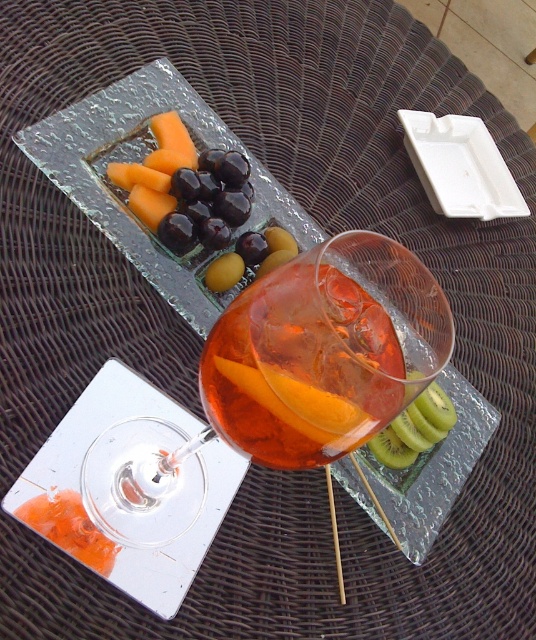
Which of these two, green matte kiwi at lower right or green kiwi at lower right, stands shorter?

With less height is green kiwi at lower right.

You are a GUI agent. You are given a task and a screenshot of the screen. Output one action in this format:
    pyautogui.click(x=<x>, y=<y>)
    Task: Click on the green matte kiwi at lower right
    This screenshot has height=640, width=536.
    Given the screenshot: What is the action you would take?
    pyautogui.click(x=414, y=429)

You are a GUI agent. You are given a task and a screenshot of the screen. Output one action in this format:
    pyautogui.click(x=<x>, y=<y>)
    Task: Click on the green matte kiwi at lower right
    The image size is (536, 640).
    Given the screenshot: What is the action you would take?
    pyautogui.click(x=414, y=429)

This screenshot has width=536, height=640. Find the location of `green matte kiwi at lower right`. green matte kiwi at lower right is located at coordinates (414, 429).

Can you confirm if translucent glass wine glass at center is thinner than green matte kiwi at lower right?

No.

Can you confirm if translucent glass wine glass at center is positioned above green matte kiwi at lower right?

Yes, translucent glass wine glass at center is above green matte kiwi at lower right.

Who is more forward, [266,310] or [444,401]?

Point [266,310] is in front.

Where is `translucent glass wine glass at center`? translucent glass wine glass at center is located at coordinates (319, 355).

Measure the distance between translucent glass wine glass at center and camera.

translucent glass wine glass at center is 19.80 centimeters from camera.

Is translucent glass wine glass at center positioned at the back of yellow matte kiwi at center?

No, it is in front of yellow matte kiwi at center.

Between point (295, 387) and point (209, 275), which one is positioned behind?

The point (209, 275) is more distant.

Where is `translucent glass wine glass at center`? translucent glass wine glass at center is located at coordinates (319, 355).